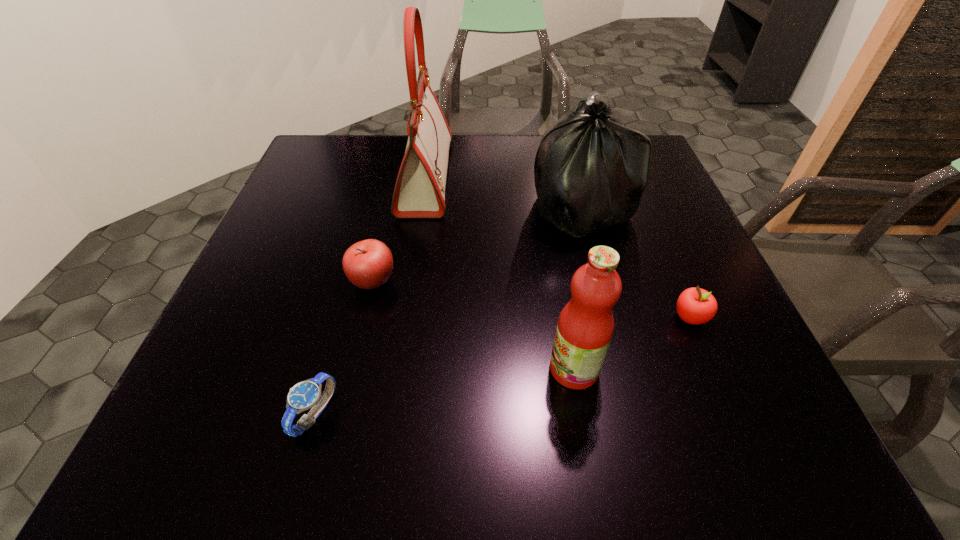
Locate an element on the screen. This screenshot has width=960, height=540. vacant space in between the plastic bag and the tallest object is located at coordinates (503, 192).

Where is `vacant area between the plastic bag and the farther apple`? vacant area between the plastic bag and the farther apple is located at coordinates (477, 244).

Locate an element on the screen. This screenshot has height=540, width=960. free spot between the shorter apple and the left apple is located at coordinates (532, 300).

Identify the location of unoccupied area between the handbag and the plastic bag. This screenshot has width=960, height=540. (503, 192).

Where is `vacant area that lies between the fruit juice and the nearer apple`? This screenshot has width=960, height=540. vacant area that lies between the fruit juice and the nearer apple is located at coordinates (633, 343).

This screenshot has width=960, height=540. Identify the location of vacant point located between the third nearest object and the handbag. (558, 247).

Point out which object is positioned as the fourth nearest to the fruit juice. Please provide its 2D coordinates. Your answer should be formatted as a tuple, i.e. [(x, y)], where the tuple contains the x and y coordinates of a point satisfying the conditions above.

[(305, 395)]

Identify which object is the fourth nearest to the third farthest object. Please provide its 2D coordinates. Your answer should be formatted as a tuple, i.e. [(x, y)], where the tuple contains the x and y coordinates of a point satisfying the conditions above.

[(585, 327)]

Identify the location of free spot that satisfies the following two spatial constraints: 1. on the front label of the fruit juice; 2. on the front side of the watch. The image size is (960, 540). (582, 414).

Locate an element on the screen. The image size is (960, 540). free spot that satisfies the following two spatial constraints: 1. on the front side of the shorter apple; 2. on the front label of the fruit juice is located at coordinates (712, 369).